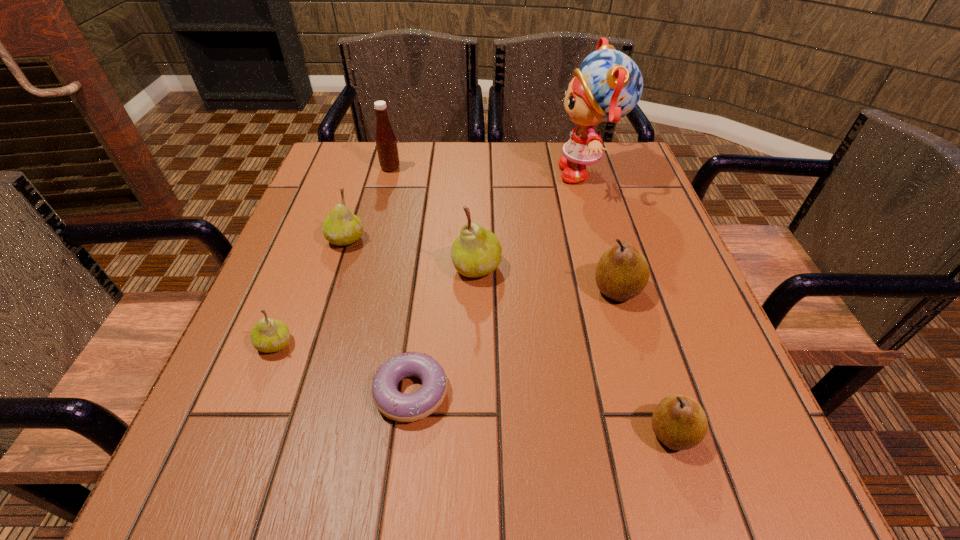
Locate an element on the screen. the third closest green pear to the smaller brown pear is located at coordinates (x=341, y=227).

Where is `free space that satisfies the following two spatial constraints: 1. on the face of the doll; 2. on the front side of the second nearest pear`? free space that satisfies the following two spatial constraints: 1. on the face of the doll; 2. on the front side of the second nearest pear is located at coordinates (639, 344).

Identify the location of free space that satisfies the following two spatial constraints: 1. on the face of the tallest object; 2. on the front side of the third pear from left to right. The width and height of the screenshot is (960, 540). (616, 267).